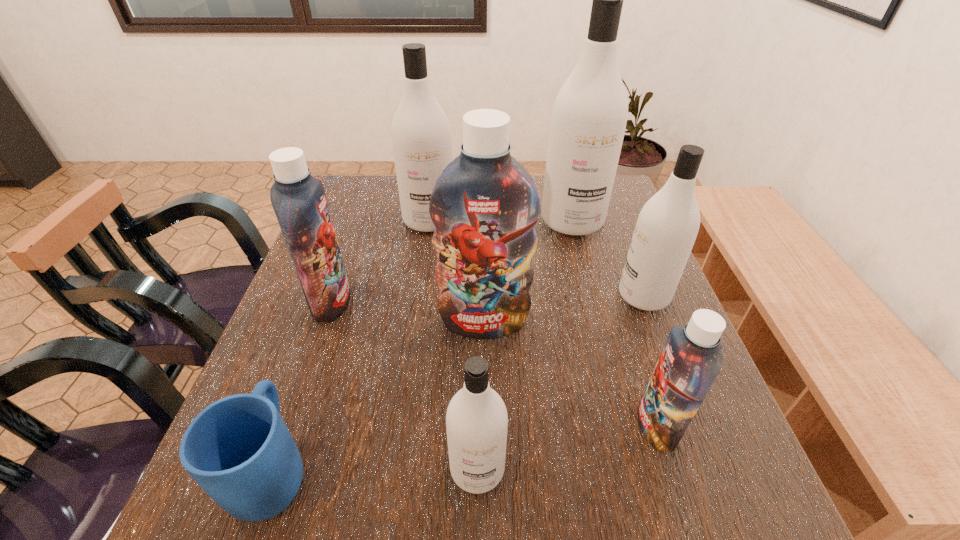
I want to click on object that is at the near left corner, so click(238, 449).

At what (x,y) coordinates should I click in order to perform the action: click on object at the far right corner. Please return your answer as a coordinate pair (x, y). Image resolution: width=960 pixels, height=540 pixels. Looking at the image, I should click on (589, 116).

Identify the location of free spot at the far edge of the desktop. The height and width of the screenshot is (540, 960). (x=389, y=210).

The image size is (960, 540). In the image, there is a desktop. What are the coordinates of `vacant space at the left edge` in the screenshot? It's located at (319, 366).

What are the coordinates of `vacant area at the far left corner of the desktop` in the screenshot? It's located at (392, 187).

Where is `vacant space in between the blue mug and the second blue shampoo from right to left`? This screenshot has width=960, height=540. vacant space in between the blue mug and the second blue shampoo from right to left is located at coordinates (378, 395).

The width and height of the screenshot is (960, 540). What are the coordinates of `free spot between the shortest object and the second smallest blue shampoo` in the screenshot? It's located at (302, 385).

The width and height of the screenshot is (960, 540). Find the location of `free space between the biggest white shampoo and the third farthest white shampoo`. free space between the biggest white shampoo and the third farthest white shampoo is located at coordinates (608, 259).

This screenshot has height=540, width=960. In order to click on vacant point located between the second blue shampoo from right to left and the leftmost shampoo in this screenshot , I will do `click(408, 312)`.

Find the location of a particular element. The width and height of the screenshot is (960, 540). empty space that is in between the third farthest white shampoo and the tallest shampoo is located at coordinates (608, 259).